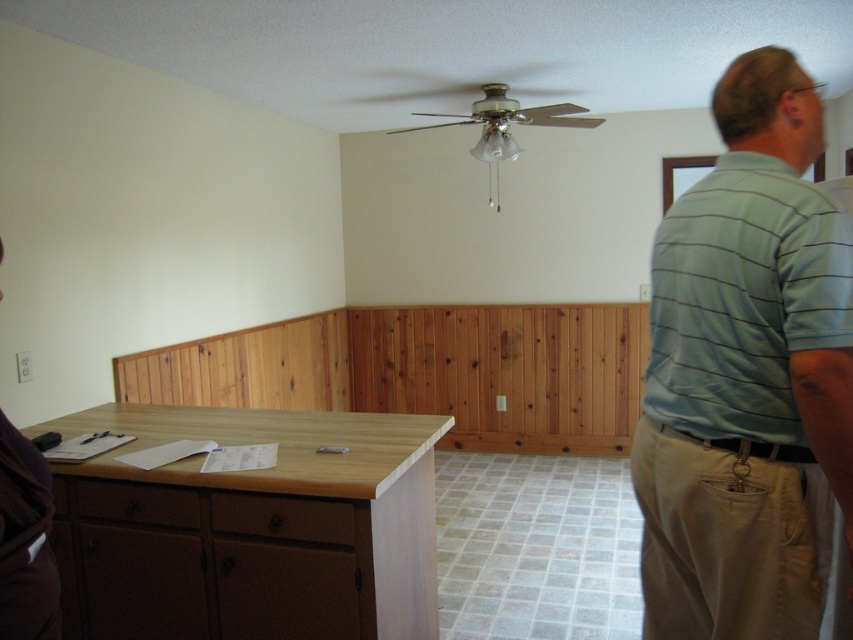
You are organizing a small event and need to place a decorative item on the countertop. You have a light blue striped shirt at upper right and a white matte outlet at left. Which object has a larger width to accommodate the item?

The light blue striped shirt at upper right has a larger width than the white matte outlet at left, so it can accommodate the decorative item better.